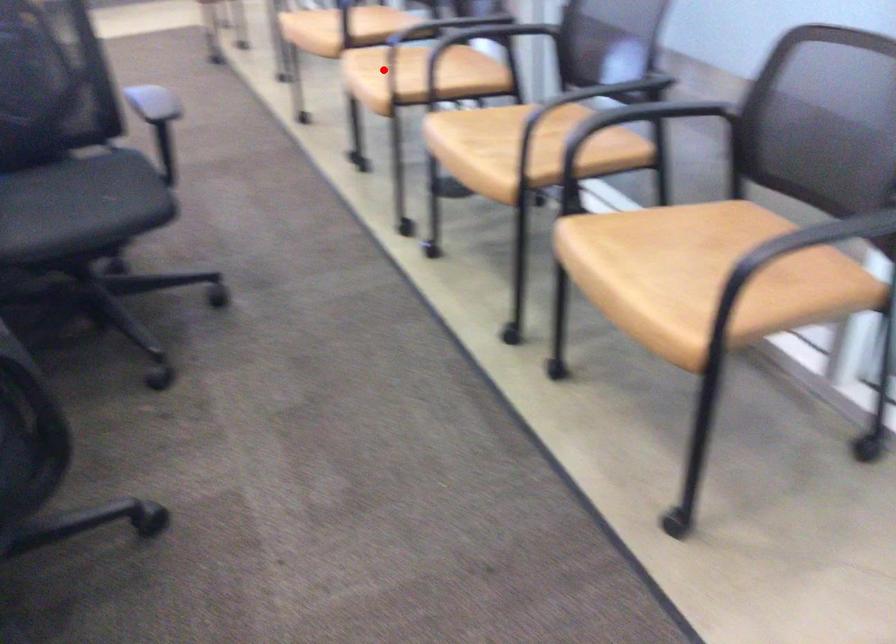
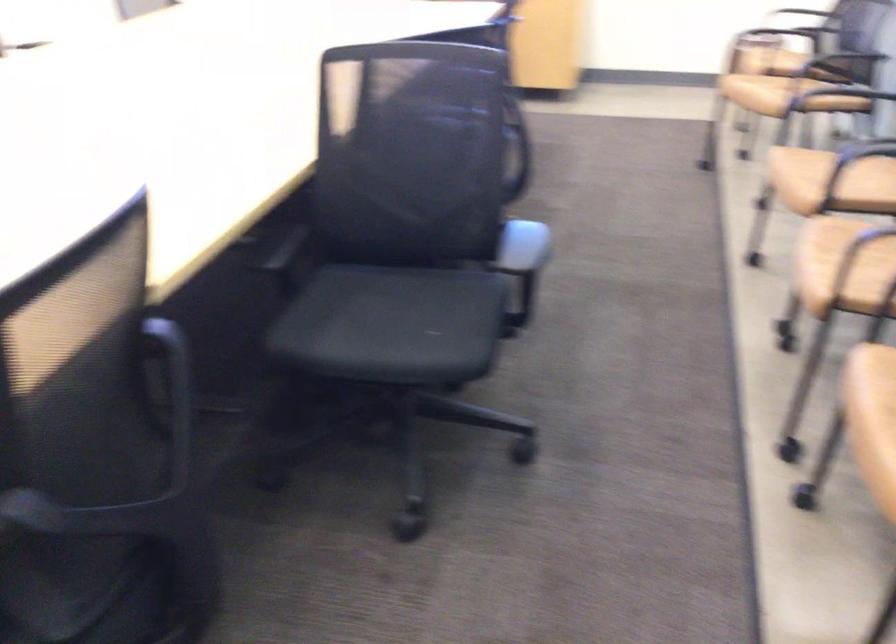
Question: A red point is marked in image1. In image2, is the corresponding 3D point closer to the camera or farther? Reply with the corresponding letter.

Choices:
 (A) The corresponding 3D point is closer.
 (B) The corresponding 3D point is farther.

Answer: (A)